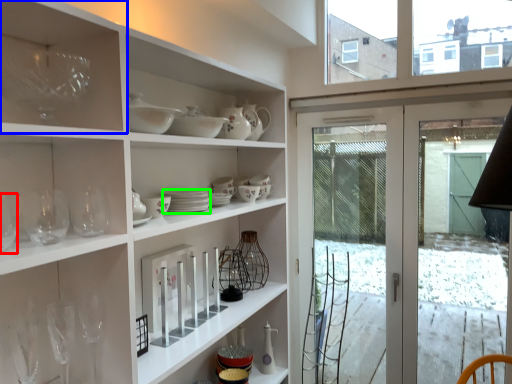
Question: Considering the real-world distances, which object is closest to wine glass (highlighted by a red box)? shelf (highlighted by a blue box) or tableware (highlighted by a green box).

Choices:
 (A) shelf
 (B) tableware

Answer: (A)